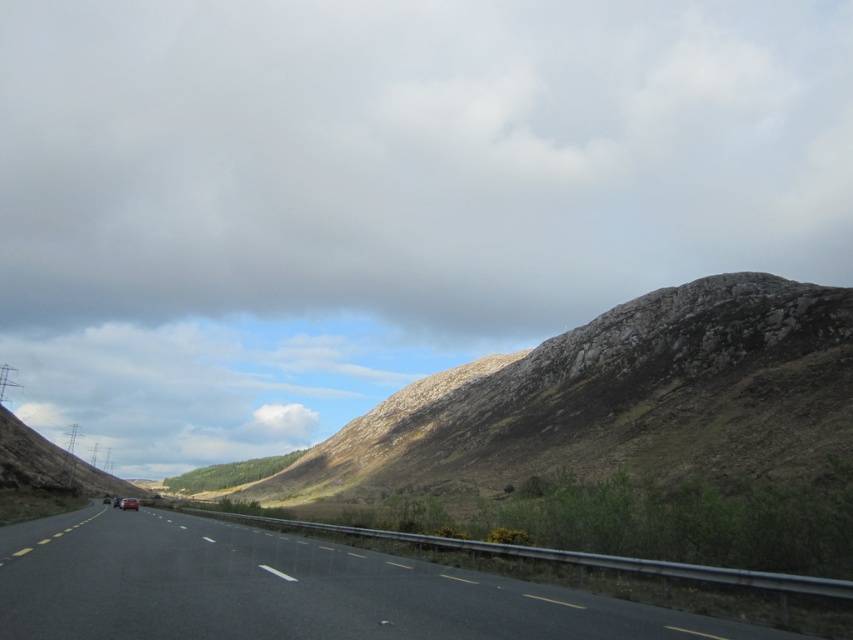
In the scene shown: You are a drone operator planning to capture aerial footage of the cloudy sky at upper center and the black asphalt highway at center. Which object will appear bigger in your camera frame?

The cloudy sky at upper center will appear bigger in the camera frame since it is larger in size than the black asphalt highway at center.

You are a drone operator planning to fly a drone over the cloudy sky at upper center and the black asphalt highway at center. Considering the height restrictions, which object allows the drone to fly higher without violating safety protocols?

The cloudy sky at upper center allows the drone to fly higher because it is taller than the black asphalt highway at center.